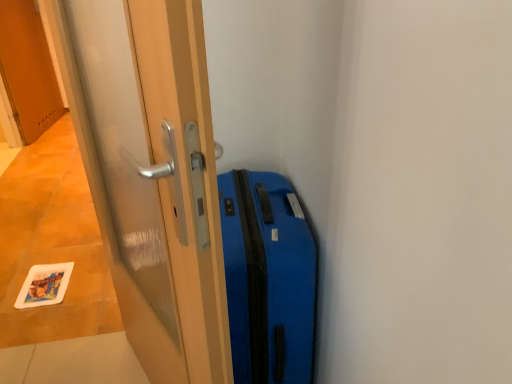
Question: Should I look upward or downward to see wooden door at upper left, acting as the 1th door starting from the top?

Choices:
 (A) up
 (B) down

Answer: (A)

Question: From a real-world perspective, is wooden door at upper left, the first door viewed from the back, located beneath blue matte suitcase at right?

Choices:
 (A) no
 (B) yes

Answer: (A)

Question: Does wooden door at upper left, marked as the 2th door in a front-to-back arrangement, have a lesser height compared to blue matte suitcase at right?

Choices:
 (A) no
 (B) yes

Answer: (A)

Question: From a real-world perspective, is wooden door at upper left, acting as the 1th door starting from the top, on blue matte suitcase at right?

Choices:
 (A) yes
 (B) no

Answer: (A)

Question: Can you confirm if wooden door at upper left, the first door viewed from the back, is taller than blue matte suitcase at right?

Choices:
 (A) yes
 (B) no

Answer: (A)

Question: Does wooden door at upper left, marked as the 2th door in a front-to-back arrangement, lie in front of blue matte suitcase at right?

Choices:
 (A) yes
 (B) no

Answer: (B)

Question: Can you confirm if wooden door at upper left, marked as the 2th door in a front-to-back arrangement, is bigger than blue matte suitcase at right?

Choices:
 (A) no
 (B) yes

Answer: (A)

Question: Could you tell me if blue matte suitcase at right is facing wooden door at upper left, acting as the 1th door starting from the top?

Choices:
 (A) no
 (B) yes

Answer: (A)

Question: Is blue matte suitcase at right outside of wooden door at upper left, marked as the 2th door in a front-to-back arrangement?

Choices:
 (A) yes
 (B) no

Answer: (A)

Question: Is blue matte suitcase at right at the right side of wooden door at upper left, marked as the 2th door in a front-to-back arrangement?

Choices:
 (A) no
 (B) yes

Answer: (B)

Question: Does blue matte suitcase at right appear on the left side of wooden door at upper left, the second door in the right-to-left sequence?

Choices:
 (A) yes
 (B) no

Answer: (B)

Question: Can you confirm if blue matte suitcase at right is taller than wooden door at upper left, the first door viewed from the back?

Choices:
 (A) yes
 (B) no

Answer: (B)

Question: Considering the relative sizes of blue matte suitcase at right and wooden door at upper left, the second door ordered from the bottom, in the image provided, is blue matte suitcase at right smaller than wooden door at upper left, the second door ordered from the bottom,?

Choices:
 (A) yes
 (B) no

Answer: (B)

Question: Is transparent glass door at center, marked as the second door in a left-to-right arrangement, bigger than blue matte suitcase at right?

Choices:
 (A) no
 (B) yes

Answer: (B)